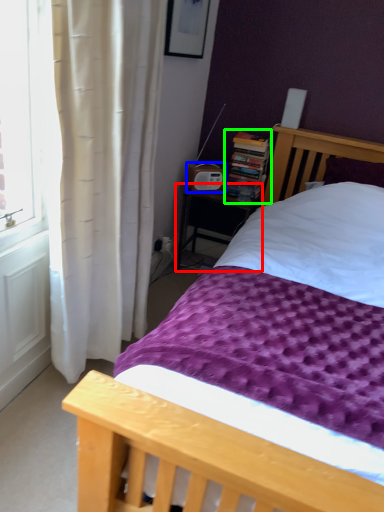
Question: Considering the real-world distances, which object is closest to nightstand (highlighted by a red box)? radio (highlighted by a blue box) or book (highlighted by a green box).

Choices:
 (A) radio
 (B) book

Answer: (A)